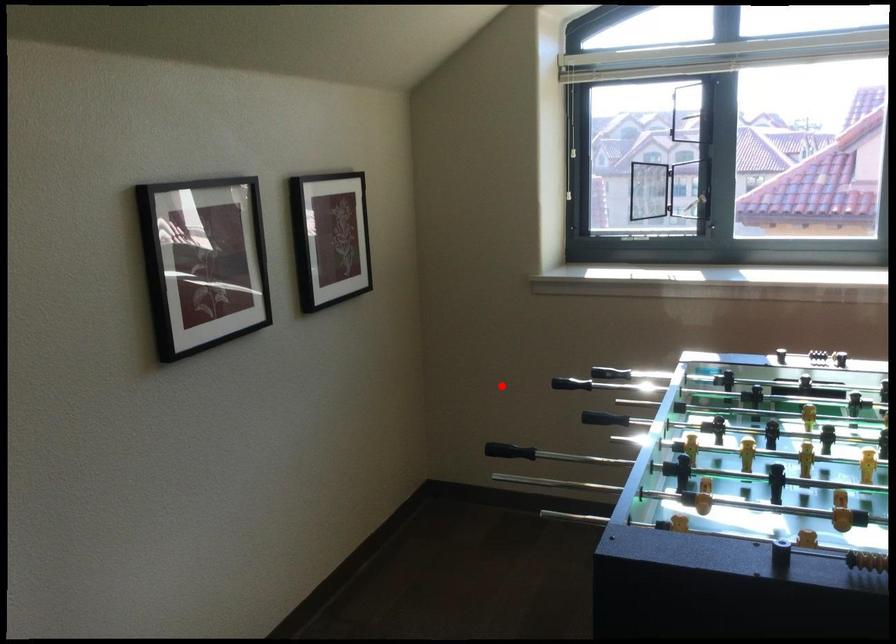
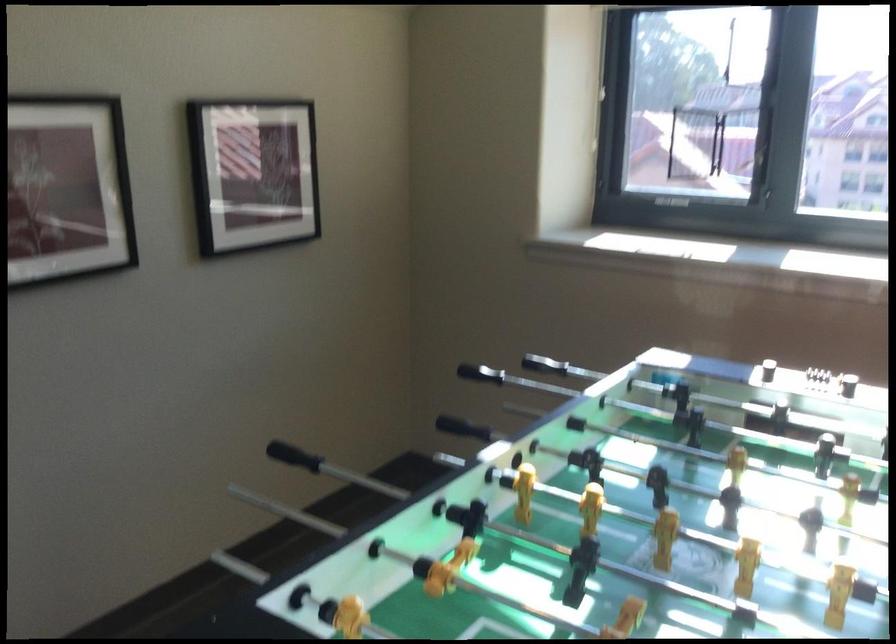
The point at the highlighted location is marked in the first image. Where is the corresponding point in the second image?

(479, 373)